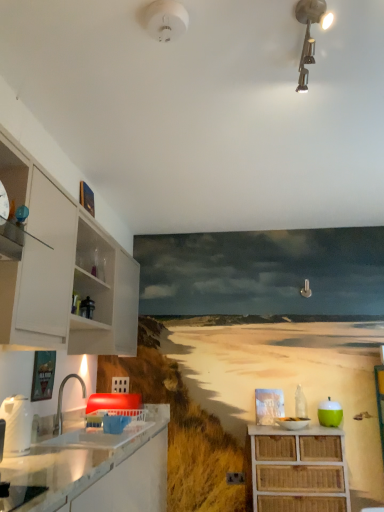
Identify the location of free space above metallic track lighting at upper center, which appears as the 1th light fixture when viewed from the right (from a real-world perspective). (304, 29).